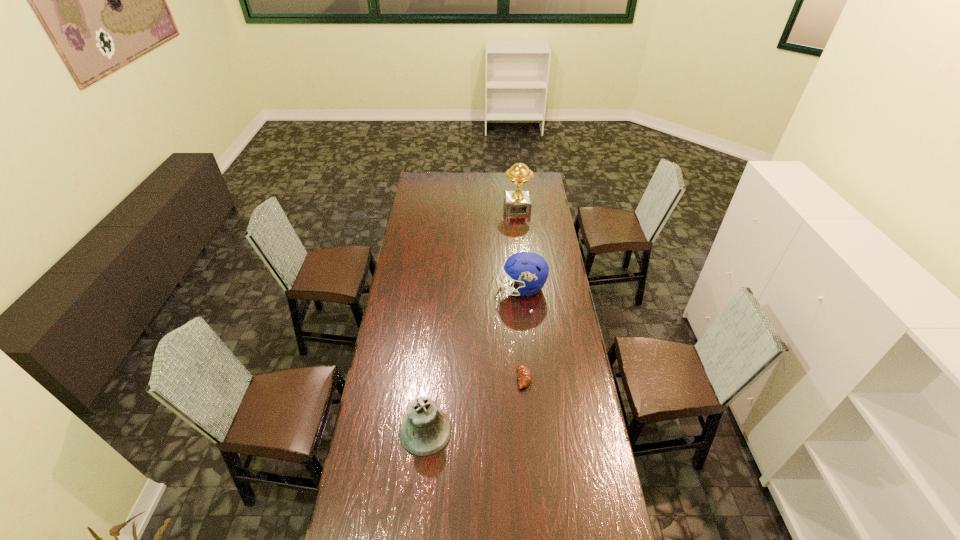
Image resolution: width=960 pixels, height=540 pixels. I want to click on free space between the third nearest object and the shortest object, so click(523, 333).

This screenshot has width=960, height=540. What are the coordinates of `free space between the third nearest object and the crescent roll` in the screenshot? It's located at (523, 333).

This screenshot has height=540, width=960. Identify the location of unoccupied area between the third nearest object and the shortest object. (523, 333).

Find the location of a particular element. vacant region between the second farthest object and the shortest object is located at coordinates (523, 333).

Find the location of a particular element. This screenshot has width=960, height=540. blank region between the shortest object and the second farthest object is located at coordinates (523, 333).

Where is `object identified as the second closest to the nearest object`? Image resolution: width=960 pixels, height=540 pixels. object identified as the second closest to the nearest object is located at coordinates (529, 270).

Locate which object is the third closest to the leftmost object. Please provide its 2D coordinates. Your answer should be formatted as a tuple, i.e. [(x, y)], where the tuple contains the x and y coordinates of a point satisfying the conditions above.

[(517, 202)]

Identify the location of free location that satisfies the following two spatial constraints: 1. on the front-facing side of the third nearest object; 2. on the front side of the leftmost object. The height and width of the screenshot is (540, 960). (536, 431).

In order to click on vacant region that satisfies the following two spatial constraints: 1. on the front-facing side of the farthest object; 2. on the front-facing side of the football helmet in this screenshot , I will do `click(526, 288)`.

This screenshot has height=540, width=960. I want to click on vacant space that satisfies the following two spatial constraints: 1. on the front-facing side of the second farthest object; 2. on the front side of the second nearest object, so click(x=531, y=378).